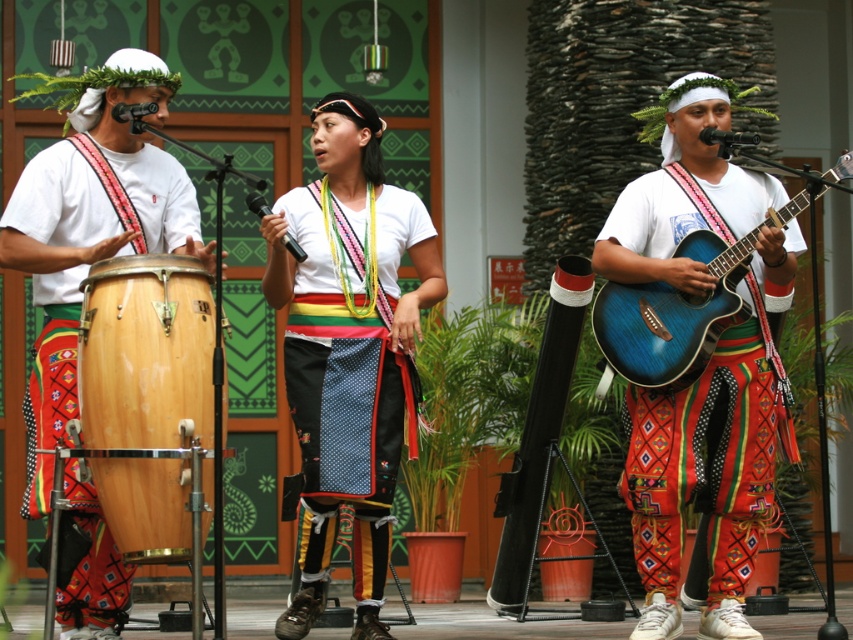
In the scene shown: Between matte wood drum at left and natural wood drum at left, which one appears on the left side from the viewer's perspective?

Positioned to the left is matte wood drum at left.

Is matte wood drum at left thinner than natural wood drum at left?

Yes.

Between point (38, 289) and point (134, 273), which one is positioned behind?

Positioned behind is point (38, 289).

Locate an element on the screen. matte wood drum at left is located at coordinates (90, 228).

Between point (309, 433) and point (686, 221), which one is positioned in front?

Point (309, 433) is in front.

Which is more to the right, white cotton shirt at center or blue wood guitar at right?

blue wood guitar at right is more to the right.

At what (x,y) coordinates should I click in order to perform the action: click on white cotton shirt at center. Please return your answer as a coordinate pair (x, y). Looking at the image, I should click on (347, 348).

Find the location of a particular element. Image resolution: width=853 pixels, height=640 pixels. white cotton shirt at center is located at coordinates (347, 348).

Does matte blue guitar at center appear over matte wood drum at left?

Yes.

You are a GUI agent. You are given a task and a screenshot of the screen. Output one action in this format:
    pyautogui.click(x=<x>, y=<y>)
    Task: Click on the matte blue guitar at center
    
    Given the screenshot: What is the action you would take?
    pyautogui.click(x=712, y=456)